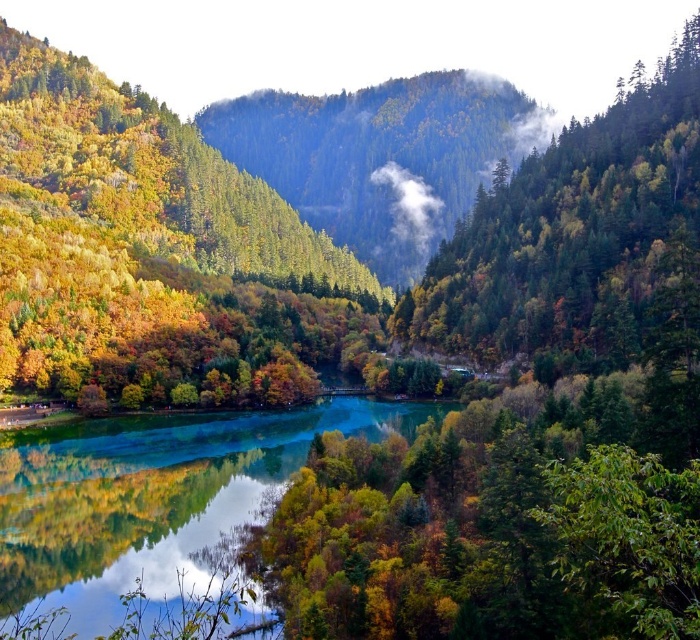
You are a hiker standing at the edge of the lake looking towards the center of the image. Which object, the green matte forest at center or the green forested mountain at center, is closer to you?

The green matte forest at center is closer to you because it is positioned below the green forested mountain at center, indicating it is situated lower and nearer in the landscape.

You are a photographer planning to capture the reflection of the green reflective water at center and the green matte forest at center in your shot. Based on their heights, which one will appear taller in the photograph?

The green matte forest at center will appear taller in the photograph because the green reflective water at center is not as tall as it.

You are standing at the edge of the lake and notice two points in the scene. The first point is labeled as point (231, 500) and the second is point (428, 212). Which of these two points is closer to you?

Point (231, 500) is closer to you because it is in front of point (428, 212).